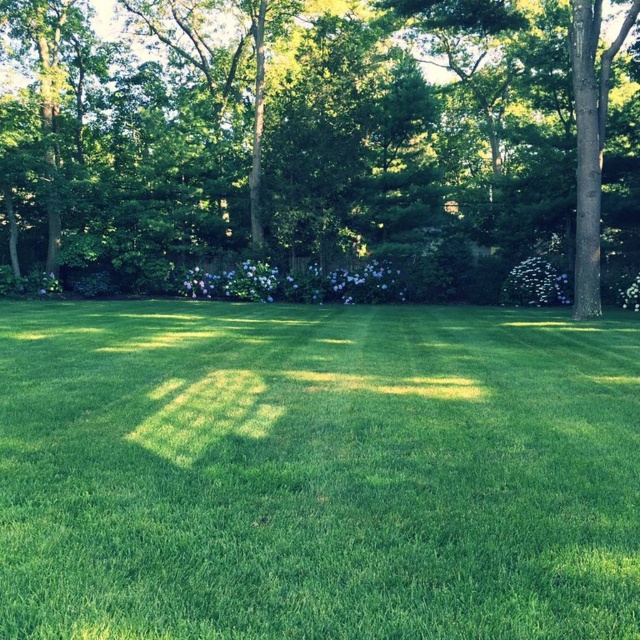
Between green grass at center and green leafy tree at center, which one is positioned higher?

green leafy tree at center is higher up.

Can you confirm if green grass at center is positioned to the left of green leafy tree at center?

In fact, green grass at center is to the right of green leafy tree at center.

Image resolution: width=640 pixels, height=640 pixels. Find the location of `green grass at center`. green grass at center is located at coordinates (316, 472).